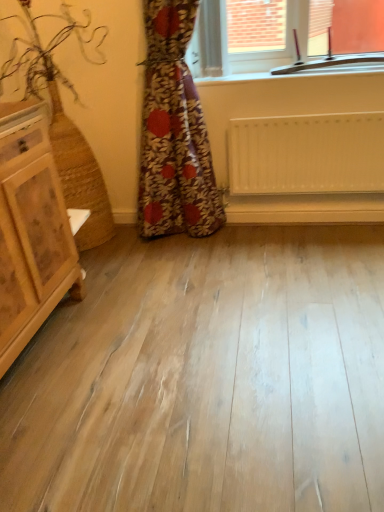
Where is `clear glass window at upper center`? Image resolution: width=384 pixels, height=512 pixels. clear glass window at upper center is located at coordinates (279, 33).

What is the approximate height of floral fabric curtain at center?

floral fabric curtain at center is 1.21 meters in height.

This screenshot has height=512, width=384. What are the coordinates of `clear glass window at upper center` in the screenshot? It's located at (279, 33).

Does point (44, 131) appear closer or farther from the camera than point (160, 30)?

Point (44, 131).

Does light brown wooden chest of drawers at left have a lesser width compared to floral fabric curtain at center?

In fact, light brown wooden chest of drawers at left might be wider than floral fabric curtain at center.

Which is more to the left, light brown wooden chest of drawers at left or floral fabric curtain at center?

light brown wooden chest of drawers at left is more to the left.

From the picture: Is light brown wooden chest of drawers at left facing towards floral fabric curtain at center?

No, light brown wooden chest of drawers at left is not oriented towards floral fabric curtain at center.

Is light brown wooden chest of drawers at left turned away from clear glass window at upper center?

light brown wooden chest of drawers at left does not have its back to clear glass window at upper center.

In the scene shown: Is light brown wooden chest of drawers at left surrounding clear glass window at upper center?

No, clear glass window at upper center is located outside of light brown wooden chest of drawers at left.

From a real-world perspective, is light brown wooden chest of drawers at left located higher than clear glass window at upper center?

No, from a real-world perspective, light brown wooden chest of drawers at left is not on top of clear glass window at upper center.

Considering the relative positions of light brown wooden chest of drawers at left and clear glass window at upper center in the image provided, is light brown wooden chest of drawers at left behind clear glass window at upper center?

No, light brown wooden chest of drawers at left is in front of clear glass window at upper center.

Locate an element on the screen. the chest of drawers that is below the clear glass window at upper center (from the image's perspective) is located at coordinates (31, 231).

Is clear glass window at upper center behind light brown wooden chest of drawers at left?

Yes, clear glass window at upper center is further from the viewer.

From the image's perspective, is clear glass window at upper center above light brown wooden chest of drawers at left?

Correct, clear glass window at upper center appears higher than light brown wooden chest of drawers at left in the image.

Between point (186, 104) and point (30, 268), which one is positioned behind?

The point (186, 104) is farther from the camera.

What's the angular difference between floral fabric curtain at center and light brown wooden chest of drawers at left's facing directions?

They differ by 87.9 degrees in their facing directions.

Is floral fabric curtain at center closer to camera compared to light brown wooden chest of drawers at left?

No, floral fabric curtain at center is behind light brown wooden chest of drawers at left.

Who is bigger, floral fabric curtain at center or light brown wooden chest of drawers at left?

light brown wooden chest of drawers at left is bigger.

From a real-world perspective, who is located lower, floral fabric curtain at center or clear glass window at upper center?

floral fabric curtain at center, from a real-world perspective.

From the image's perspective, which is above, floral fabric curtain at center or clear glass window at upper center?

clear glass window at upper center.

How much distance is there between floral fabric curtain at center and clear glass window at upper center?

floral fabric curtain at center and clear glass window at upper center are 46.65 centimeters apart.

Is point (184, 12) behind point (340, 16)?

No, it is not.

Could light brown wooden chest of drawers at left be considered to be inside white matte radiator at center?

No, light brown wooden chest of drawers at left is located outside of white matte radiator at center.

Find the location of a particular element. The image size is (384, 512). radiator above the light brown wooden chest of drawers at left (from the image's perspective) is located at coordinates (306, 154).

From the image's perspective, which object appears higher, white matte radiator at center or light brown wooden chest of drawers at left?

From the image's view, white matte radiator at center is above.

Looking at their sizes, would you say white matte radiator at center is wider or thinner than light brown wooden chest of drawers at left?

white matte radiator at center is thinner than light brown wooden chest of drawers at left.

Is white matte radiator at center at the back of floral fabric curtain at center?

No, floral fabric curtain at center is not facing away from white matte radiator at center.

How different are the orientations of floral fabric curtain at center and white matte radiator at center in degrees?

0.512 degrees separate the facing orientations of floral fabric curtain at center and white matte radiator at center.

Locate an element on the screen. Image resolution: width=384 pixels, height=512 pixels. curtain on the left of the white matte radiator at center is located at coordinates (174, 132).

Who is bigger, floral fabric curtain at center or white matte radiator at center?

Bigger between the two is floral fabric curtain at center.

Find the location of `the chest of drawers that is under the floral fabric curtain at center (from a real-world perspective)`. the chest of drawers that is under the floral fabric curtain at center (from a real-world perspective) is located at coordinates (31, 231).

The height and width of the screenshot is (512, 384). What are the coordinates of `window above the light brown wooden chest of drawers at left (from the image's perspective)` in the screenshot? It's located at (279, 33).

Based on their spatial positions, is white matte radiator at center or clear glass window at upper center further from floral fabric curtain at center?

clear glass window at upper center is positioned further to the anchor floral fabric curtain at center.

Based on their spatial positions, is floral fabric curtain at center or white matte radiator at center closer to clear glass window at upper center?

white matte radiator at center lies closer to clear glass window at upper center than the other object.

Based on their spatial positions, is floral fabric curtain at center or light brown wooden chest of drawers at left further from white matte radiator at center?

light brown wooden chest of drawers at left is further to white matte radiator at center.

Looking at the image, which one is located further to light brown wooden chest of drawers at left, clear glass window at upper center or white matte radiator at center?

clear glass window at upper center.

Considering their positions, is clear glass window at upper center positioned closer to floral fabric curtain at center than white matte radiator at center?

Among the two, white matte radiator at center is located nearer to floral fabric curtain at center.

From the image, which object appears to be farther from white matte radiator at center, floral fabric curtain at center or clear glass window at upper center?

Among the two, clear glass window at upper center is located further to white matte radiator at center.

Considering their positions, is floral fabric curtain at center positioned closer to clear glass window at upper center than light brown wooden chest of drawers at left?

The object closer to clear glass window at upper center is floral fabric curtain at center.

When comparing their distances from floral fabric curtain at center, does clear glass window at upper center or light brown wooden chest of drawers at left seem further?

Among the two, light brown wooden chest of drawers at left is located further to floral fabric curtain at center.

The height and width of the screenshot is (512, 384). I want to click on window between light brown wooden chest of drawers at left and white matte radiator at center, so click(x=279, y=33).

You are a GUI agent. You are given a task and a screenshot of the screen. Output one action in this format:
    pyautogui.click(x=<x>, y=<y>)
    Task: Click on the window situated between floral fabric curtain at center and white matte radiator at center from left to right
    
    Given the screenshot: What is the action you would take?
    tap(279, 33)

Locate an element on the screen. curtain between light brown wooden chest of drawers at left and white matte radiator at center from left to right is located at coordinates (174, 132).

Identify the location of curtain between light brown wooden chest of drawers at left and clear glass window at upper center from left to right. click(174, 132).